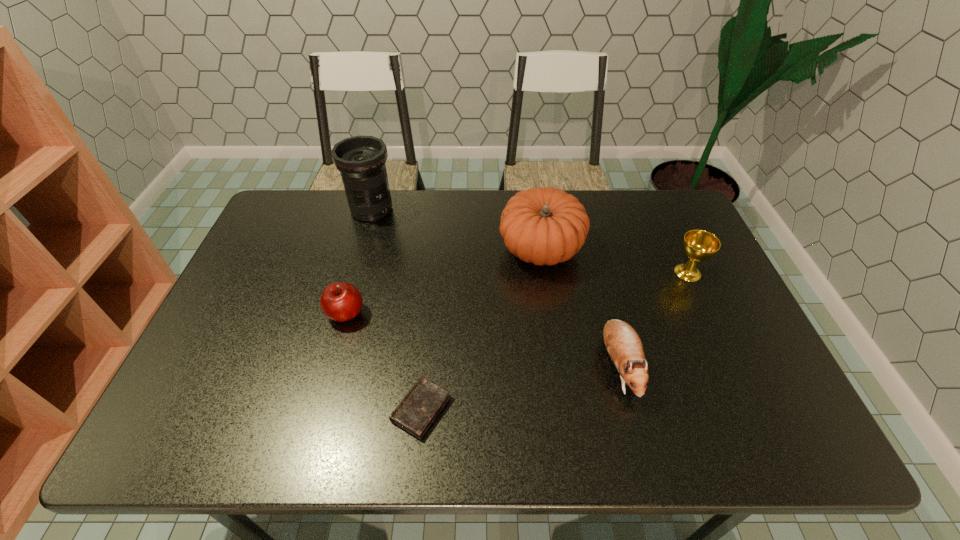
The height and width of the screenshot is (540, 960). I want to click on vacant area at the near left corner, so click(230, 432).

Locate an element on the screen. The height and width of the screenshot is (540, 960). vacant space at the far right corner of the desktop is located at coordinates (648, 222).

Locate an element on the screen. The width and height of the screenshot is (960, 540). free point between the shortest object and the hamster is located at coordinates (519, 387).

Locate an element on the screen. vacant space in between the tallest object and the pumpkin is located at coordinates (456, 230).

Locate an element on the screen. empty location between the hamster and the third object from left to right is located at coordinates (519, 387).

Identify the location of free space that is in between the chalice and the hamster. (653, 319).

Where is `free point between the shortest object and the rightmost object`? The image size is (960, 540). free point between the shortest object and the rightmost object is located at coordinates (555, 340).

Image resolution: width=960 pixels, height=540 pixels. Find the location of `free space that is in between the pumpkin and the tallest object`. free space that is in between the pumpkin and the tallest object is located at coordinates (456, 230).

At what (x,y) coordinates should I click in order to perform the action: click on free point between the rightmost object and the fifth shortest object. Please return your answer as a coordinate pair (x, y). Image resolution: width=960 pixels, height=540 pixels. Looking at the image, I should click on (614, 260).

Image resolution: width=960 pixels, height=540 pixels. What are the coordinates of `free space between the tallest object and the fifth shortest object` in the screenshot? It's located at (456, 230).